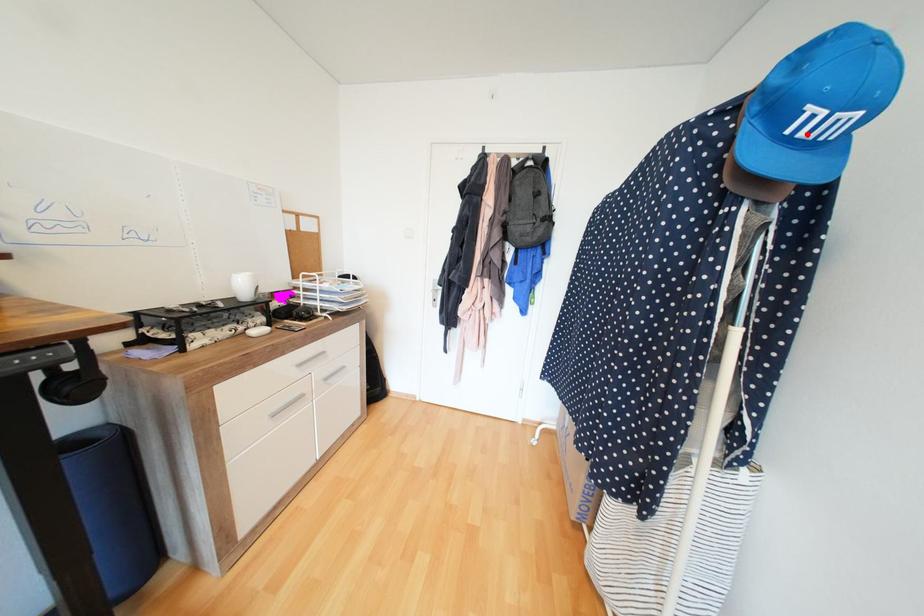
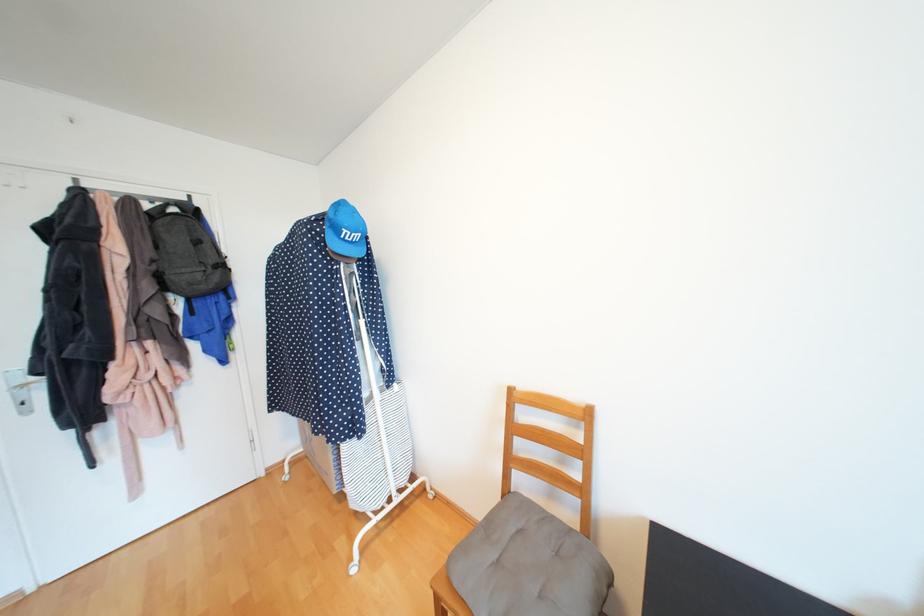
In the second image, find the point that corresponds to the highlighted location in the first image.

(353, 238)